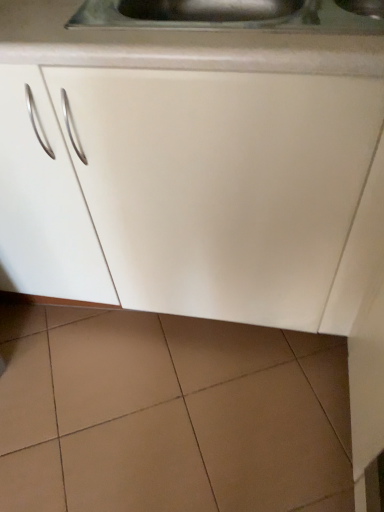
Describe the element at coordinates (178, 45) in the screenshot. This screenshot has width=384, height=512. I see `white matte countertop at upper center` at that location.

Image resolution: width=384 pixels, height=512 pixels. Identify the location of white matte countertop at upper center. (178, 45).

What are the coordinates of `white matte countertop at upper center` in the screenshot? It's located at (178, 45).